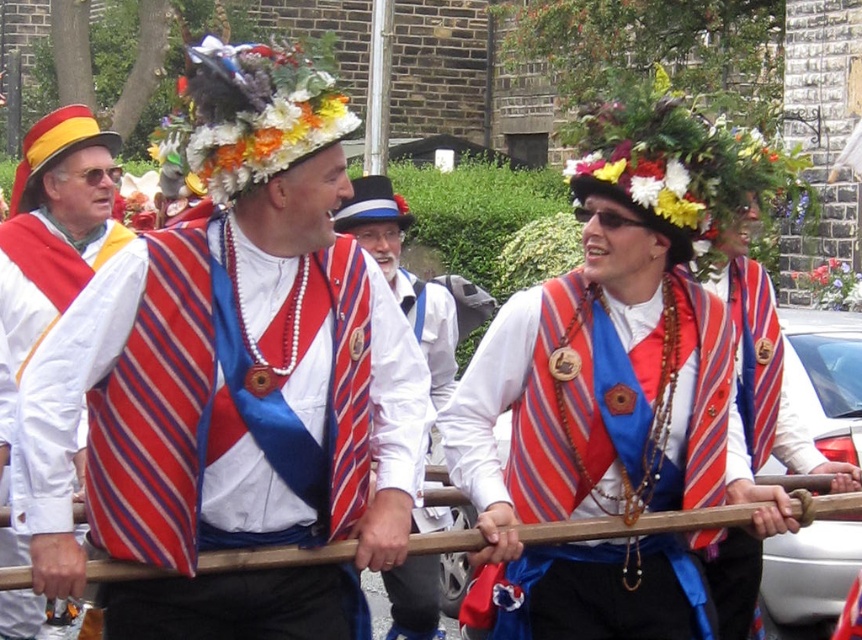
Question: Which object is positioned farthest from the matte red vest at center?

Choices:
 (A) matte fabric vest at center
 (B) matte white robe at left

Answer: (B)

Question: Which point is farther from the camera taking this photo?

Choices:
 (A) [x=175, y=275]
 (B) [x=23, y=355]
 (C) [x=386, y=253]

Answer: (C)

Question: Is matte fabric vest at center behind matte white robe at left?

Choices:
 (A) yes
 (B) no

Answer: (B)

Question: Can you confirm if matte fabric vest at center is positioned above matte red vest at center?

Choices:
 (A) no
 (B) yes

Answer: (B)

Question: Which of the following is the farthest from the observer?

Choices:
 (A) (417, 284)
 (B) (16, 321)

Answer: (A)

Question: Does matte fabric vest at center appear on the left side of matte white robe at left?

Choices:
 (A) no
 (B) yes

Answer: (A)